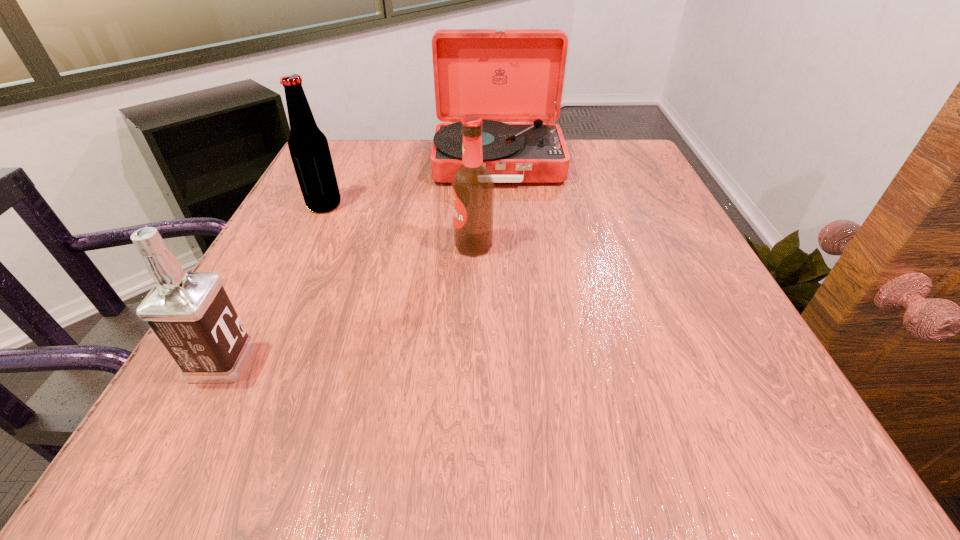
Image resolution: width=960 pixels, height=540 pixels. Identify the location of object present at the far edge. (501, 75).

At what (x,y) coordinates should I click in order to perform the action: click on beer bottle that is at the left edge. Please return your answer as a coordinate pair (x, y). Image resolution: width=960 pixels, height=540 pixels. Looking at the image, I should click on (309, 150).

What are the coordinates of `vodka that is at the left edge` in the screenshot? It's located at (191, 314).

Locate an element on the screen. vacant area at the far edge is located at coordinates (415, 164).

This screenshot has height=540, width=960. Find the location of `vacant space at the near edge of the desktop`. vacant space at the near edge of the desktop is located at coordinates (445, 408).

Locate an element on the screen. The width and height of the screenshot is (960, 540). free space at the left edge of the desktop is located at coordinates (254, 395).

In the image, there is a desktop. Identify the location of vacant space at the right edge. The width and height of the screenshot is (960, 540). click(x=678, y=212).

In the image, there is a desktop. At what (x,y) coordinates should I click in order to perform the action: click on vacant space at the far left corner. Please return your answer as a coordinate pair (x, y). This screenshot has width=960, height=540. Looking at the image, I should click on (340, 161).

You are a GUI agent. You are given a task and a screenshot of the screen. Output one action in this format:
    pyautogui.click(x=<x>, y=<y>)
    Task: Click on the free space at the far right corner
    
    Given the screenshot: What is the action you would take?
    pyautogui.click(x=593, y=153)

At what (x,y) coordinates should I click in order to perform the action: click on free point at the near right corner. Please return your answer as a coordinate pair (x, y). This screenshot has width=960, height=540. Looking at the image, I should click on [746, 417].